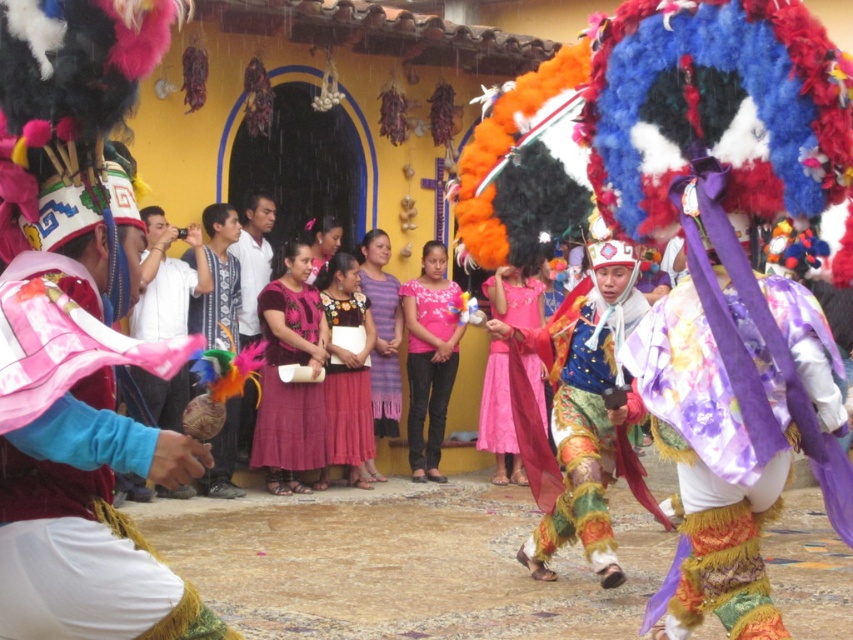
Is point (77, 380) closer to camera compared to point (334, 390)?

Yes, it is in front of point (334, 390).

Who is taller, matte pink fabric at left or embroidered fabric dress at center?

embroidered fabric dress at center

Who is more forward, (42, 548) or (349, 371)?

Point (42, 548) is in front.

This screenshot has height=640, width=853. In order to click on matte pink fabric at left in this screenshot , I will do `click(74, 468)`.

From the picture: Can you confirm if white cotton shirt at center is thinner than purple satin dress at center?

Correct, white cotton shirt at center's width is less than purple satin dress at center's.

Which is behind, point (263, 284) or point (383, 291)?

Positioned behind is point (383, 291).

Image resolution: width=853 pixels, height=640 pixels. I want to click on white cotton shirt at center, so click(x=253, y=260).

Is multicolored feathered headdress at center wider than embroidered fabric dress at center?

Correct, the width of multicolored feathered headdress at center exceeds that of embroidered fabric dress at center.

Which is above, multicolored feathered headdress at center or embroidered fabric dress at center?

Positioned higher is multicolored feathered headdress at center.

The width and height of the screenshot is (853, 640). Describe the element at coordinates (218, 301) in the screenshot. I see `multicolored feathered headdress at center` at that location.

This screenshot has height=640, width=853. What are the coordinates of `multicolored feathered headdress at center` in the screenshot? It's located at (218, 301).